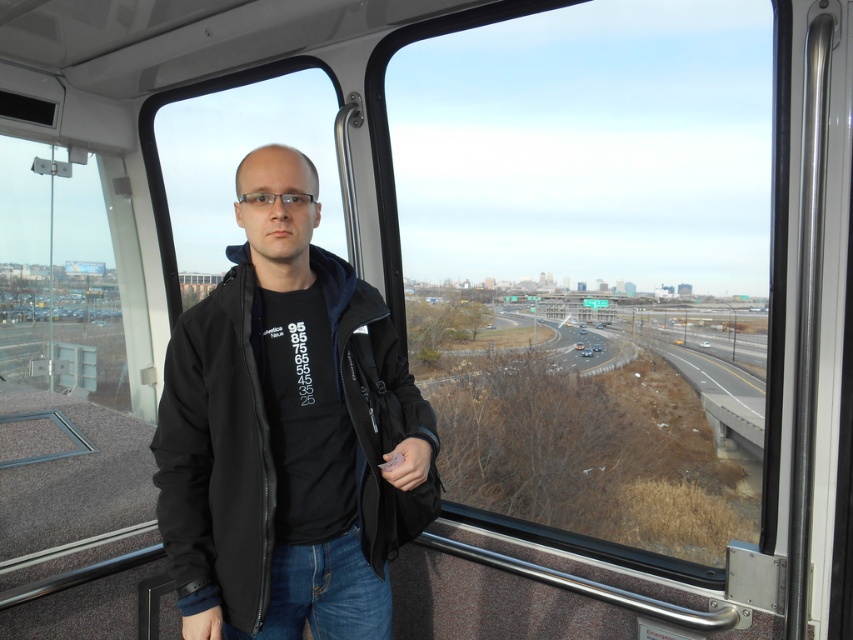
Question: Is transparent glass window at center bigger than black softshell jacket at center?

Choices:
 (A) no
 (B) yes

Answer: (B)

Question: Which point appears closest to the camera in this image?

Choices:
 (A) 743,112
 (B) 233,337

Answer: (B)

Question: Does transparent glass window at center have a larger size compared to black softshell jacket at center?

Choices:
 (A) no
 (B) yes

Answer: (B)

Question: Which point is farther to the camera?

Choices:
 (A) transparent glass window at center
 (B) black softshell jacket at center

Answer: (A)

Question: Where is transparent glass window at center located in relation to black softshell jacket at center in the image?

Choices:
 (A) above
 (B) below

Answer: (A)